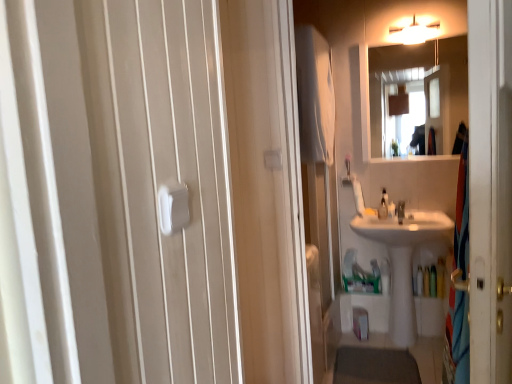
Question: Considering the relative sizes of white glossy mirror at upper center and translucent plastic bottle at lower right, which is the first toiletry from right to left, in the image provided, is white glossy mirror at upper center thinner than translucent plastic bottle at lower right, which is the first toiletry from right to left,?

Choices:
 (A) yes
 (B) no

Answer: (A)

Question: From the image's perspective, is white glossy mirror at upper center below translucent plastic bottle at lower right, arranged as the second toiletry when viewed from the left?

Choices:
 (A) yes
 (B) no

Answer: (B)

Question: Is white glossy mirror at upper center shorter than translucent plastic bottle at lower right, arranged as the second toiletry when viewed from the left?

Choices:
 (A) yes
 (B) no

Answer: (B)

Question: Can you confirm if white glossy mirror at upper center is smaller than translucent plastic bottle at lower right, arranged as the second toiletry when viewed from the left?

Choices:
 (A) yes
 (B) no

Answer: (B)

Question: Is white glossy mirror at upper center touching translucent plastic bottle at lower right, which is the first toiletry from right to left?

Choices:
 (A) no
 (B) yes

Answer: (A)

Question: Relative to white glossy sink at center, is transparent plastic screen door at right in front or behind?

Choices:
 (A) behind
 (B) front

Answer: (B)

Question: Does point (480, 120) appear closer or farther from the camera than point (382, 233)?

Choices:
 (A) closer
 (B) farther

Answer: (A)

Question: Based on their sizes in the image, would you say transparent plastic screen door at right is bigger or smaller than white glossy sink at center?

Choices:
 (A) small
 (B) big

Answer: (A)

Question: In terms of width, does transparent plastic screen door at right look wider or thinner when compared to white glossy sink at center?

Choices:
 (A) thin
 (B) wide

Answer: (A)

Question: Does point (167, 198) appear closer or farther from the camera than point (509, 367)?

Choices:
 (A) closer
 (B) farther

Answer: (A)

Question: Looking at their shapes, would you say white plastic towel bar at center is wider or thinner than transparent plastic screen door at right?

Choices:
 (A) thin
 (B) wide

Answer: (A)

Question: From the image's perspective, is white plastic towel bar at center above or below transparent plastic screen door at right?

Choices:
 (A) below
 (B) above

Answer: (B)

Question: Considering the positions of white plastic towel bar at center and transparent plastic screen door at right in the image, is white plastic towel bar at center taller or shorter than transparent plastic screen door at right?

Choices:
 (A) tall
 (B) short

Answer: (B)

Question: From a real-world perspective, is white glossy sink at center positioned above or below translucent plastic bottle at lower right, which is the first toiletry from right to left?

Choices:
 (A) below
 (B) above

Answer: (B)

Question: From the image's perspective, is white glossy sink at center above or below translucent plastic bottle at lower right, which is the first toiletry from right to left?

Choices:
 (A) below
 (B) above

Answer: (B)